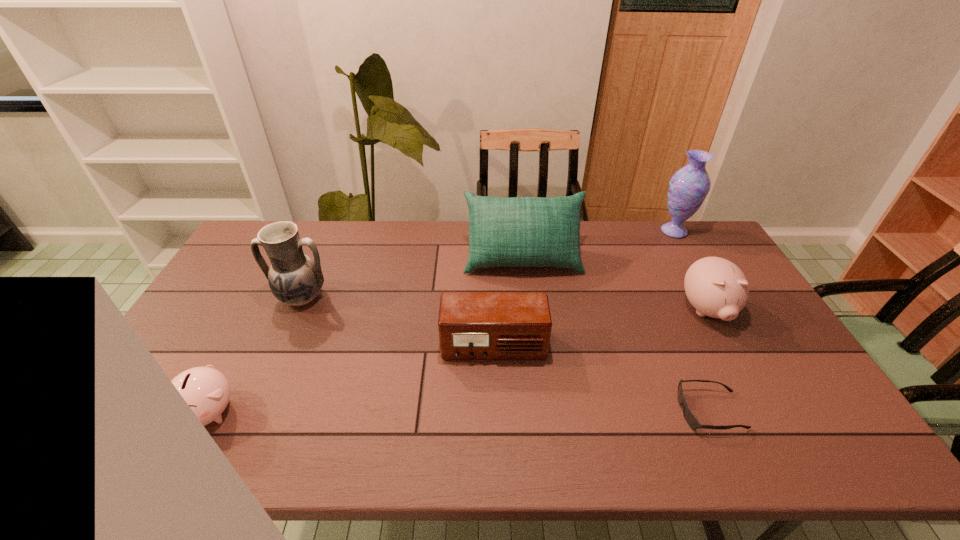
Identify the location of vacant space located on the front-facing side of the pitcher. The image size is (960, 540). (257, 397).

Locate an element on the screen. The width and height of the screenshot is (960, 540). vacant position located 0.270m on the front-facing side of the cushion is located at coordinates (532, 343).

Where is `vacant point located 0.210m at the snout of the farther piggy bank`? This screenshot has height=540, width=960. vacant point located 0.210m at the snout of the farther piggy bank is located at coordinates (756, 400).

In order to click on free space located on the front-facing side of the radio receiver in this screenshot , I will do `click(497, 458)`.

Locate an element on the screen. The image size is (960, 540). free space located 0.150m on the right of the shorter piggy bank is located at coordinates (299, 411).

Locate an element on the screen. Image resolution: width=960 pixels, height=540 pixels. free region located on the front-facing side of the sunglasses is located at coordinates point(554,411).

The height and width of the screenshot is (540, 960). Identify the location of free location located 0.330m on the front-facing side of the sunglasses. (545, 411).

This screenshot has height=540, width=960. I want to click on free space located on the front-facing side of the sunglasses, so click(x=643, y=411).

I want to click on vase at the far edge, so click(x=688, y=188).

I want to click on cushion that is at the far edge, so click(519, 231).